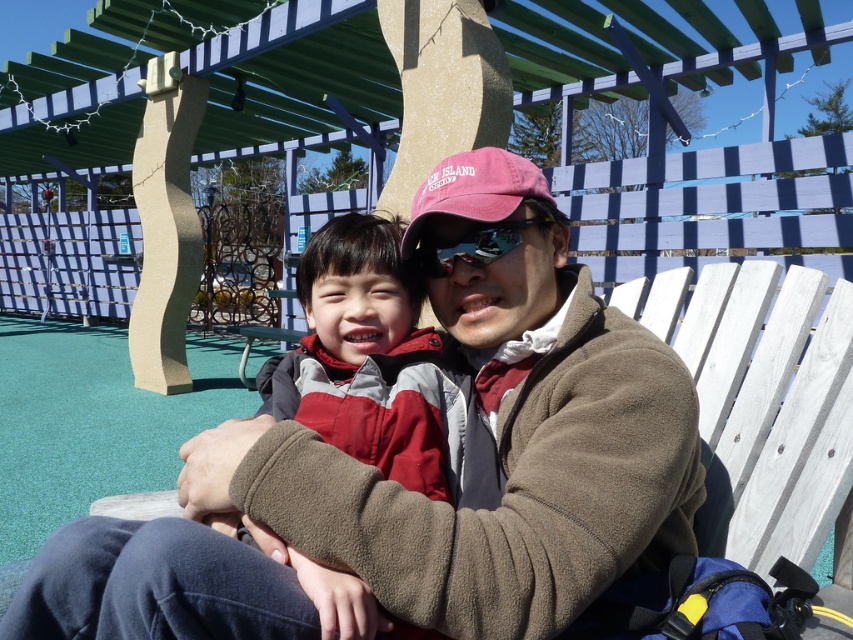
You are a photographer trying to capture a photo of the red fleece jacket at center and the maroon fabric baseball cap at center. If you want to ensure both items are fully visible in the frame, which item requires more space horizontally?

The red fleece jacket at center requires more horizontal space because its width is larger than the maroon fabric baseball cap at center.

You are a photographer taking a picture of the scene. You notice the red fleece jacket at center and the sunglasses at center. Which object should you focus on first to ensure both are in focus?

The red fleece jacket at center is in front of the sunglasses at center, so you should focus on the red fleece jacket at center first to ensure both are in focus.

You are a photographer trying to capture a candid shot of the two subjects. You need to ensure that both the red fleece jacket at center and the sunglasses at center are clearly visible in the frame. Given their sizes, which object should you focus on to ensure proper framing?

The red fleece jacket at center is wider than the sunglasses at center, so focusing on the red fleece jacket at center will help ensure proper framing as it takes up more space in the image.